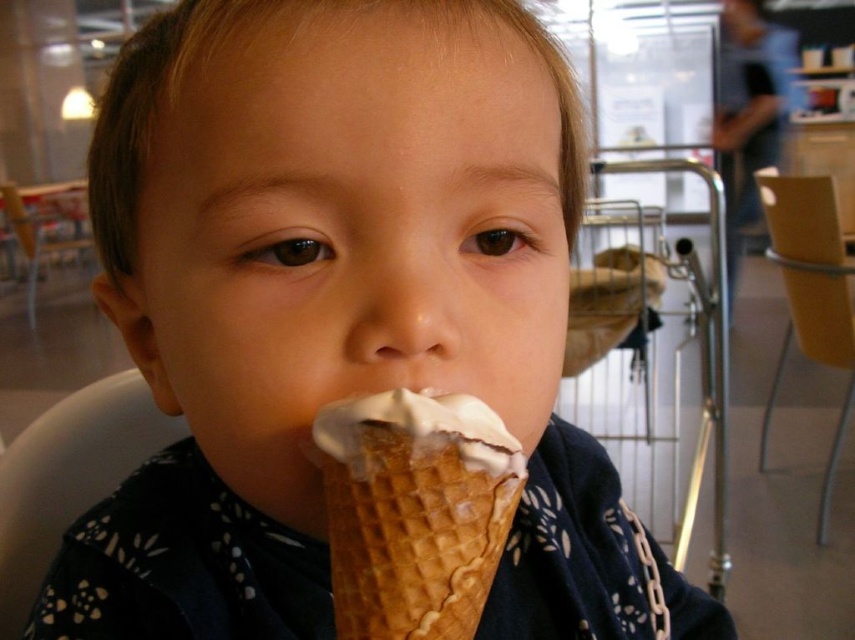
You are a photographer trying to capture the child and the ice cream cone in the image. You notice two points marked as point 1 at coordinates (437, 524) and point 2 at coordinates (9, 536). Which point should you focus on to ensure the child and ice cream are in sharp focus?

You should focus on point 1 at coordinates (437, 524) because it is closer to the viewer than point 2 at coordinates (9, 536), ensuring the child and ice cream are in sharp focus.

You are taking a photo of the child and their ice cream cone. You want to focus on the point closer to the camera. Which point should you choose between point (329, 424) and point (21, 234)?

Point (329, 424) is closer to the camera than point (21, 234), so you should choose point (329, 424) to focus on.

You are sitting in the white plastic chair at lower left and want to move to the yellow plastic chair at right. Which direction should you move to reach it?

A: The yellow plastic chair at right is located above the white plastic chair at lower left, so you should move upward to reach it.